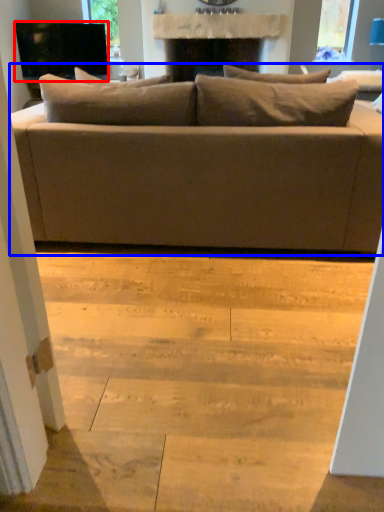
Question: Which point is further to the camera, television (highlighted by a red box) or studio couch (highlighted by a blue box)?

Choices:
 (A) television
 (B) studio couch

Answer: (A)